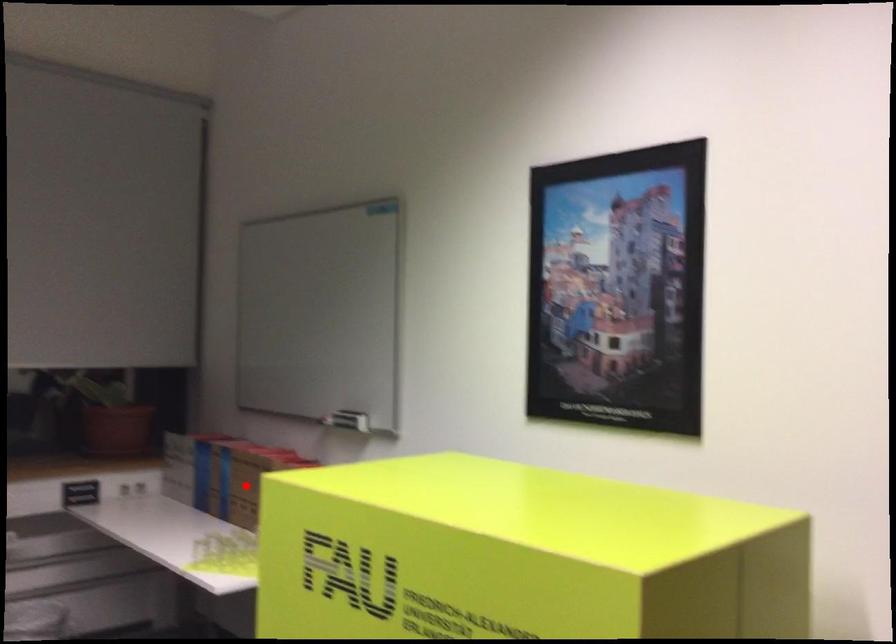
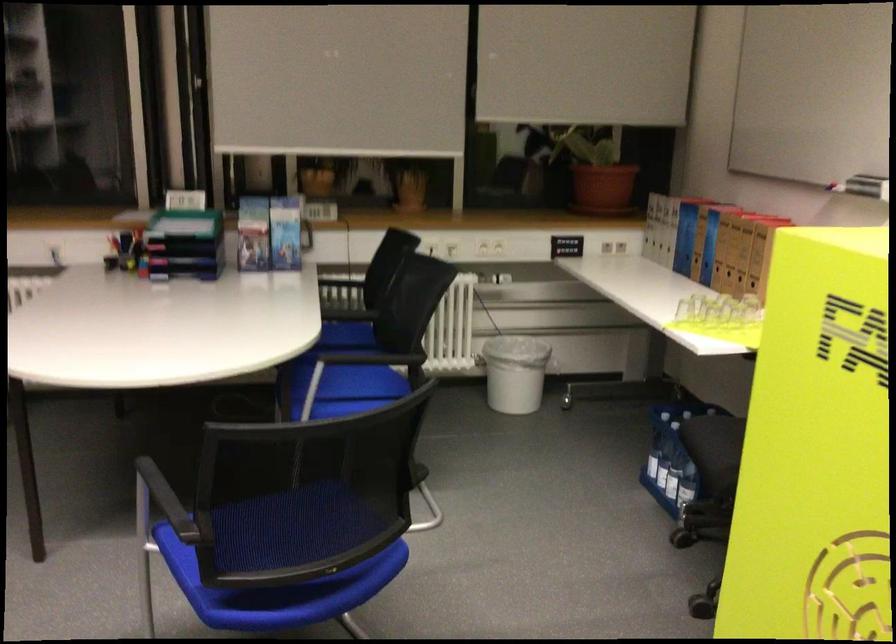
In the second image, find the point that corresponds to the highlighted location in the first image.

(730, 251)